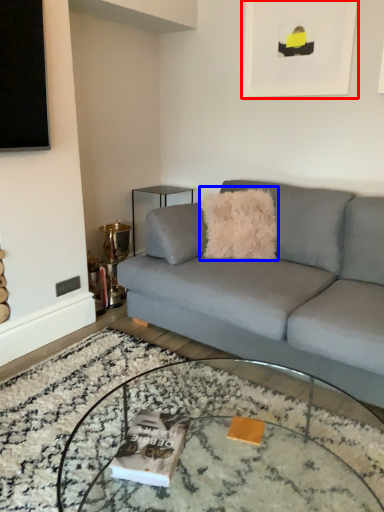
Question: Which point is closer to the camera, picture frame (highlighted by a red box) or throw pillow (highlighted by a blue box)?

Choices:
 (A) picture frame
 (B) throw pillow

Answer: (A)